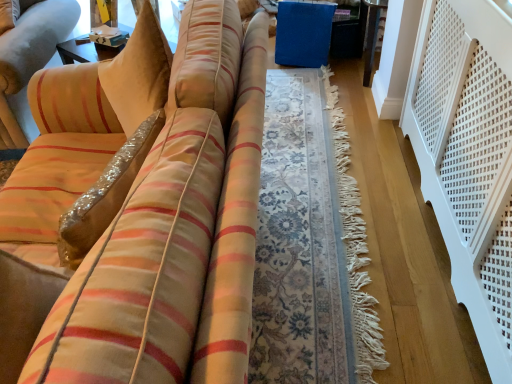
Question: Does white cardboard box at upper left have a lesser height compared to white perforated balustrade at right?

Choices:
 (A) yes
 (B) no

Answer: (A)

Question: Is white perforated balustrade at right located within white cardboard box at upper left?

Choices:
 (A) no
 (B) yes

Answer: (A)

Question: Does white cardboard box at upper left have a greater height compared to white perforated balustrade at right?

Choices:
 (A) yes
 (B) no

Answer: (B)

Question: From the image's perspective, is white cardboard box at upper left on top of white perforated balustrade at right?

Choices:
 (A) yes
 (B) no

Answer: (A)

Question: Is white cardboard box at upper left wider than white perforated balustrade at right?

Choices:
 (A) yes
 (B) no

Answer: (B)

Question: Is white cardboard box at upper left directly adjacent to white perforated balustrade at right?

Choices:
 (A) no
 (B) yes

Answer: (A)

Question: From the image's perspective, does white perforated balustrade at right appear higher than white cardboard box at upper left?

Choices:
 (A) no
 (B) yes

Answer: (A)

Question: Does white perforated balustrade at right appear on the right side of white cardboard box at upper left?

Choices:
 (A) yes
 (B) no

Answer: (A)

Question: Considering the relative sizes of white perforated balustrade at right and white cardboard box at upper left in the image provided, is white perforated balustrade at right smaller than white cardboard box at upper left?

Choices:
 (A) yes
 (B) no

Answer: (B)

Question: Is the depth of white perforated balustrade at right less than that of white cardboard box at upper left?

Choices:
 (A) yes
 (B) no

Answer: (A)

Question: Does white perforated balustrade at right contain white cardboard box at upper left?

Choices:
 (A) no
 (B) yes

Answer: (A)

Question: Does white perforated balustrade at right have a greater width compared to white cardboard box at upper left?

Choices:
 (A) yes
 (B) no

Answer: (A)

Question: In terms of width, does white cardboard box at upper left look wider or thinner when compared to white perforated balustrade at right?

Choices:
 (A) wide
 (B) thin

Answer: (B)